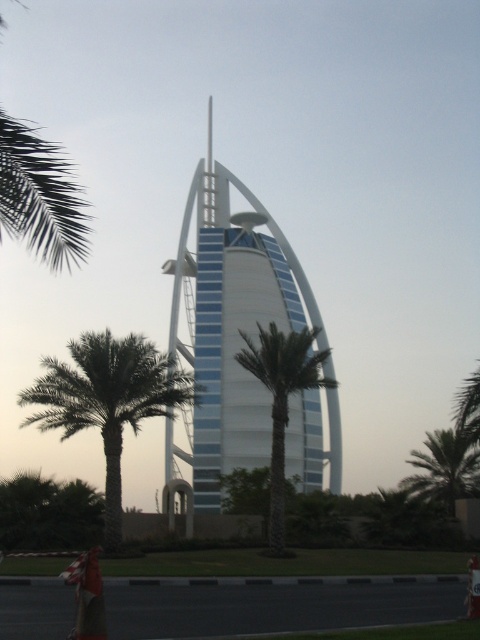
Does point (317, 353) come closer to viewer compared to point (205, 195)?

Yes, it is.

Between green leafy palm tree at center and smooth glass spire at center, which one is positioned lower?

green leafy palm tree at center is below.

This screenshot has width=480, height=640. What are the coordinates of `green leafy palm tree at center` in the screenshot? It's located at (283, 401).

Can you confirm if green leafy palm tree at right is smaller than smooth glass spire at center?

Actually, green leafy palm tree at right might be larger than smooth glass spire at center.

From the picture: Is green leafy palm tree at right shorter than smooth glass spire at center?

Correct, green leafy palm tree at right is not as tall as smooth glass spire at center.

Image resolution: width=480 pixels, height=640 pixels. I want to click on green leafy palm tree at right, so click(x=444, y=468).

Can you confirm if white smooth tower at center is taller than green leafy palm tree at right?

Indeed, white smooth tower at center has a greater height compared to green leafy palm tree at right.

Measure the distance between point (x=314, y=440) and camera.

Point (x=314, y=440) is 113.62 meters from camera.

Image resolution: width=480 pixels, height=640 pixels. Find the location of `white smooth tower at center`. white smooth tower at center is located at coordinates (229, 330).